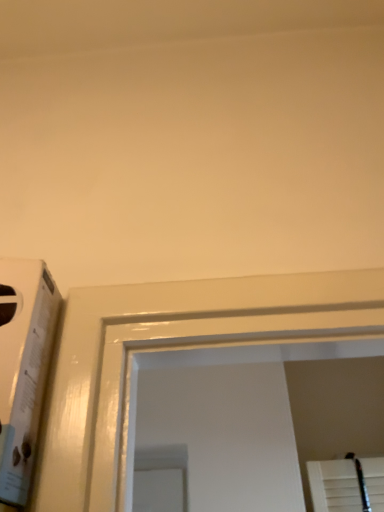
The width and height of the screenshot is (384, 512). Find the location of `white cardboard box at left`. white cardboard box at left is located at coordinates (23, 367).

What do you see at coordinates (23, 367) in the screenshot? The height and width of the screenshot is (512, 384). I see `white cardboard box at left` at bounding box center [23, 367].

This screenshot has height=512, width=384. I want to click on white cardboard box at left, so click(23, 367).